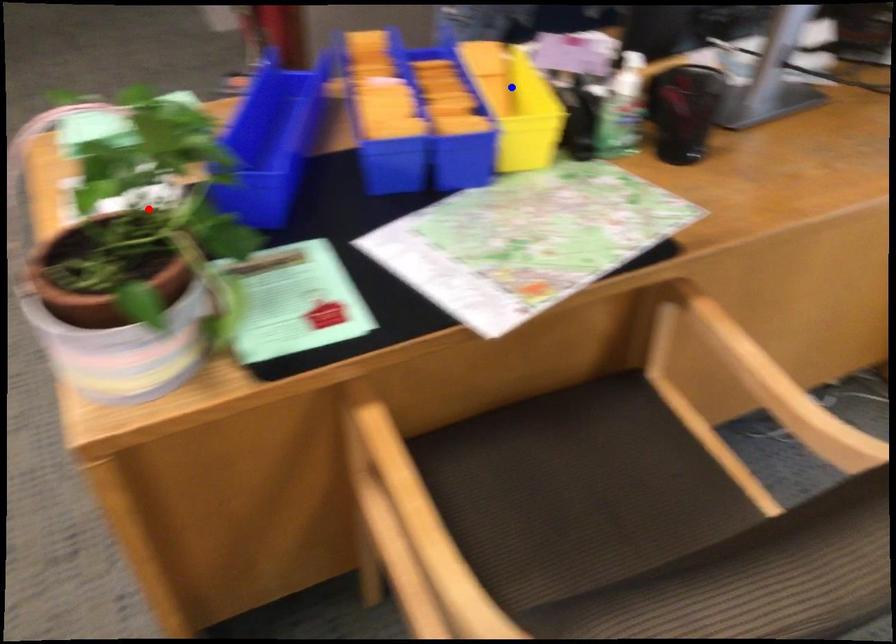
Question: In the image, two points are highlighted. Which point is nearer to the camera? Reply with the corresponding letter.

Choices:
 (A) blue point
 (B) red point

Answer: (B)